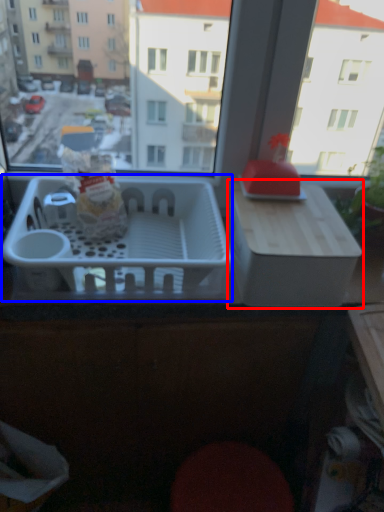
Question: Which object appears farthest to the camera in this image, cardboard box (highlighted by a red box) or basket (highlighted by a blue box)?

Choices:
 (A) cardboard box
 (B) basket

Answer: (A)